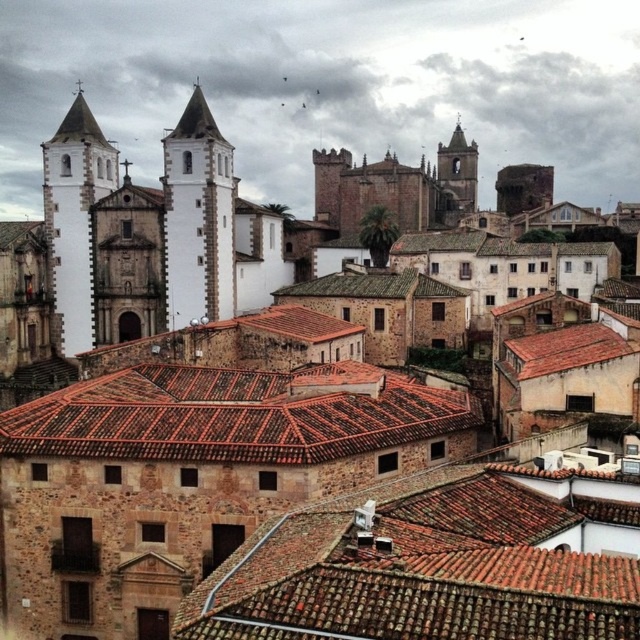
You are an architect analyzing the historic town layout. Based on the image, which of the two structures, the brown tile roof at center or the white stone tower at upper left, would require a taller ladder to reach its peak for maintenance?

The white stone tower at upper left is taller than the brown tile roof at center, so a taller ladder would be needed for the white stone tower at upper left.